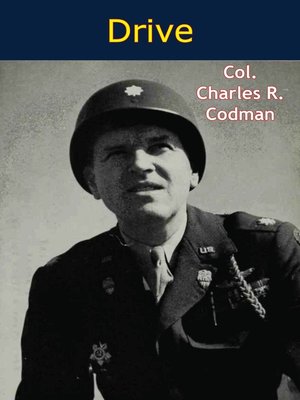
Find the location of a particular element. This screenshot has height=400, width=300. decorative braid is located at coordinates (252, 299).